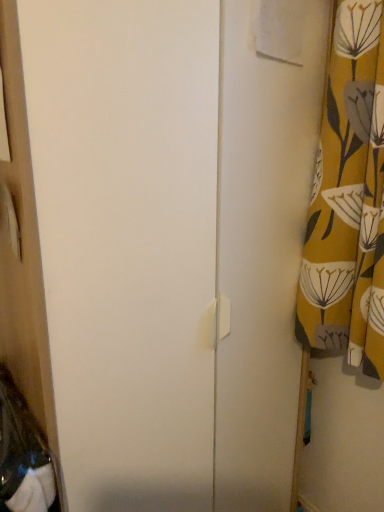
Question: Is white matte screen door at center to the left of yellow floral fabric at right from the viewer's perspective?

Choices:
 (A) no
 (B) yes

Answer: (B)

Question: From the image's perspective, is white matte screen door at center beneath yellow floral fabric at right?

Choices:
 (A) no
 (B) yes

Answer: (B)

Question: Is white matte screen door at center positioned with its back to yellow floral fabric at right?

Choices:
 (A) no
 (B) yes

Answer: (A)

Question: Is white matte screen door at center facing towards yellow floral fabric at right?

Choices:
 (A) no
 (B) yes

Answer: (B)

Question: Does white matte screen door at center lie in front of yellow floral fabric at right?

Choices:
 (A) no
 (B) yes

Answer: (B)

Question: Is the depth of white matte screen door at center greater than that of yellow floral fabric at right?

Choices:
 (A) yes
 (B) no

Answer: (B)

Question: From the image's perspective, would you say yellow floral fabric at right is positioned over white matte screen door at center?

Choices:
 (A) yes
 (B) no

Answer: (A)

Question: Is yellow floral fabric at right not close to white matte screen door at center?

Choices:
 (A) no
 (B) yes

Answer: (A)

Question: From a real-world perspective, is yellow floral fabric at right on top of white matte screen door at center?

Choices:
 (A) no
 (B) yes

Answer: (B)

Question: Considering the relative sizes of yellow floral fabric at right and white matte screen door at center in the image provided, is yellow floral fabric at right smaller than white matte screen door at center?

Choices:
 (A) no
 (B) yes

Answer: (B)

Question: Is yellow floral fabric at right looking in the opposite direction of white matte screen door at center?

Choices:
 (A) no
 (B) yes

Answer: (A)

Question: Could you tell me if yellow floral fabric at right is turned towards white matte screen door at center?

Choices:
 (A) no
 (B) yes

Answer: (A)

Question: Looking at their shapes, would you say white matte screen door at center is wider or thinner than yellow floral fabric at right?

Choices:
 (A) thin
 (B) wide

Answer: (B)